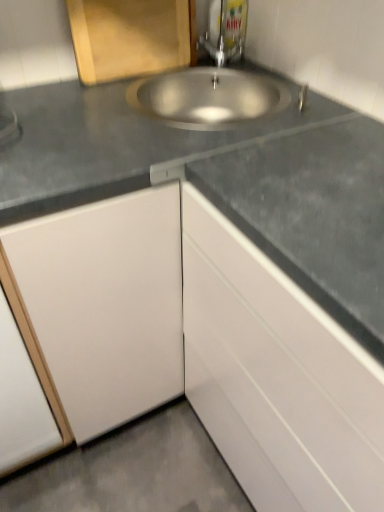
Question: Considering the relative sizes of wooden cutting board at upper left, positioned as the 2th cabinetry in bottom-to-top order, and white glossy cabinet at lower right, positioned as the 1th cabinetry in bottom-to-top order, in the image provided, is wooden cutting board at upper left, positioned as the 2th cabinetry in bottom-to-top order, smaller than white glossy cabinet at lower right, positioned as the 1th cabinetry in bottom-to-top order,?

Choices:
 (A) yes
 (B) no

Answer: (A)

Question: Does wooden cutting board at upper left, positioned as the 2th cabinetry in bottom-to-top order, come behind white glossy cabinet at lower right, arranged as the first cabinetry when viewed from the right?

Choices:
 (A) no
 (B) yes

Answer: (B)

Question: From a real-world perspective, is wooden cutting board at upper left, positioned as the 2th cabinetry in bottom-to-top order, beneath white glossy cabinet at lower right, arranged as the second cabinetry when viewed from the left?

Choices:
 (A) yes
 (B) no

Answer: (B)

Question: From a real-world perspective, is wooden cutting board at upper left, which ranks as the second cabinetry in right-to-left order, physically above white glossy cabinet at lower right, positioned as the 2th cabinetry in top-to-bottom order?

Choices:
 (A) yes
 (B) no

Answer: (A)

Question: Would you say wooden cutting board at upper left, which ranks as the second cabinetry in right-to-left order, is outside white glossy cabinet at lower right, positioned as the 2th cabinetry in top-to-bottom order?

Choices:
 (A) yes
 (B) no

Answer: (A)

Question: Is wooden cutting board at upper left, placed as the first cabinetry when sorted from top to bottom, facing towards white glossy cabinet at lower right, arranged as the second cabinetry when viewed from the left?

Choices:
 (A) no
 (B) yes

Answer: (A)

Question: Is white glossy cabinet at lower right, arranged as the second cabinetry when viewed from the left, wider than metallic faucet at upper center?

Choices:
 (A) no
 (B) yes

Answer: (B)

Question: Does white glossy cabinet at lower right, positioned as the 1th cabinetry in bottom-to-top order, have a lesser width compared to metallic faucet at upper center?

Choices:
 (A) yes
 (B) no

Answer: (B)

Question: Is white glossy cabinet at lower right, positioned as the 2th cabinetry in top-to-bottom order, located outside metallic faucet at upper center?

Choices:
 (A) yes
 (B) no

Answer: (A)

Question: Is white glossy cabinet at lower right, arranged as the second cabinetry when viewed from the left, bigger than metallic faucet at upper center?

Choices:
 (A) yes
 (B) no

Answer: (A)

Question: Can you confirm if white glossy cabinet at lower right, positioned as the 1th cabinetry in bottom-to-top order, is shorter than metallic faucet at upper center?

Choices:
 (A) yes
 (B) no

Answer: (B)

Question: Considering the relative positions of metallic faucet at upper center and wooden cutting board at upper left, which is the 1th cabinetry from left to right, in the image provided, is metallic faucet at upper center to the left of wooden cutting board at upper left, which is the 1th cabinetry from left to right, from the viewer's perspective?

Choices:
 (A) no
 (B) yes

Answer: (A)